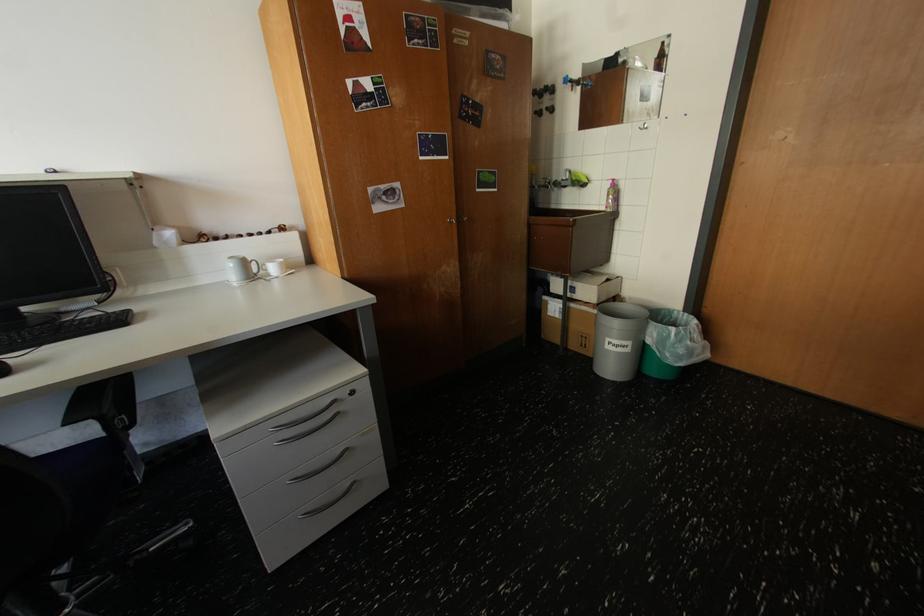
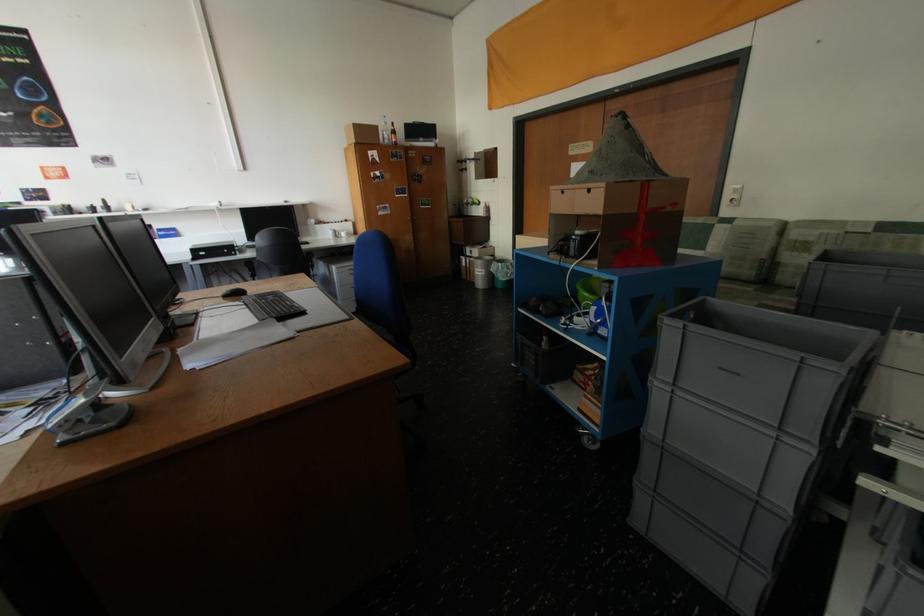
Where in the second image is the point corresponding to (504,191) from the first image?

(439, 208)